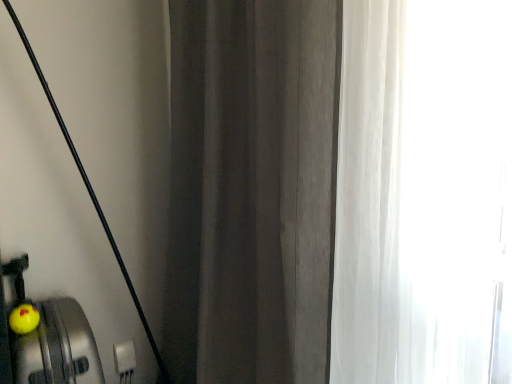
Question: Can you confirm if dark gray fabric curtain at center is positioned to the right of yellow rubber duck at lower left?

Choices:
 (A) yes
 (B) no

Answer: (A)

Question: From a real-world perspective, is dark gray fabric curtain at center under yellow rubber duck at lower left?

Choices:
 (A) yes
 (B) no

Answer: (B)

Question: Is dark gray fabric curtain at center beside yellow rubber duck at lower left?

Choices:
 (A) no
 (B) yes

Answer: (A)

Question: Does dark gray fabric curtain at center come behind yellow rubber duck at lower left?

Choices:
 (A) no
 (B) yes

Answer: (A)

Question: Considering the relative sizes of dark gray fabric curtain at center and yellow rubber duck at lower left in the image provided, is dark gray fabric curtain at center taller than yellow rubber duck at lower left?

Choices:
 (A) no
 (B) yes

Answer: (B)

Question: From the image's perspective, is dark gray fabric curtain at center on top of yellow rubber duck at lower left?

Choices:
 (A) yes
 (B) no

Answer: (A)

Question: Considering the relative positions of yellow rubber duck at lower left and dark gray fabric curtain at center in the image provided, is yellow rubber duck at lower left in front of dark gray fabric curtain at center?

Choices:
 (A) no
 (B) yes

Answer: (A)

Question: Considering the relative sizes of yellow rubber duck at lower left and dark gray fabric curtain at center in the image provided, is yellow rubber duck at lower left wider than dark gray fabric curtain at center?

Choices:
 (A) no
 (B) yes

Answer: (A)

Question: Is yellow rubber duck at lower left not close to dark gray fabric curtain at center?

Choices:
 (A) yes
 (B) no

Answer: (B)

Question: From the image's perspective, is yellow rubber duck at lower left above dark gray fabric curtain at center?

Choices:
 (A) yes
 (B) no

Answer: (B)

Question: Is yellow rubber duck at lower left to the left of dark gray fabric curtain at center from the viewer's perspective?

Choices:
 (A) no
 (B) yes

Answer: (B)

Question: Can you confirm if yellow rubber duck at lower left is taller than dark gray fabric curtain at center?

Choices:
 (A) yes
 (B) no

Answer: (B)

Question: Considering their positions, is dark gray fabric curtain at center located in front of or behind yellow rubber duck at lower left?

Choices:
 (A) behind
 (B) front

Answer: (B)